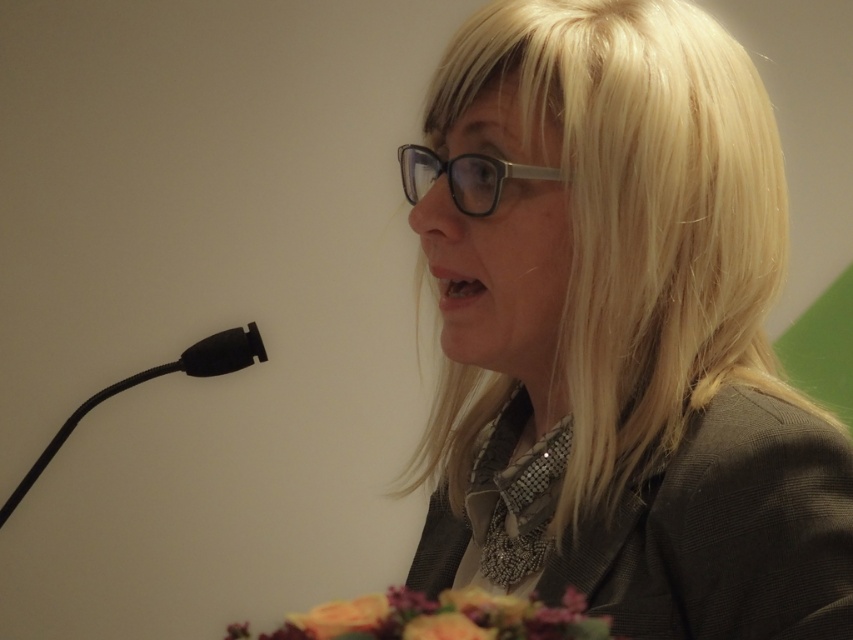
You are a photographer at the event and need to adjust the lighting so that the blonde silky hair at center and the black matte microphone at lower left are both well lit. Which object should you focus on first to ensure the taller one gets enough light?

The blonde silky hair at center is much taller than the black matte microphone at lower left, so you should focus on lighting the blonde silky hair at center first to ensure it is properly illuminated.

You are a photographer positioned at the camera. You need to capture a closeup shot of the floral bouquet at lower center. Considering the distance between you and the bouquet, can you move closer to take the photo without stepping over the 19.05 inches limit?

The distance between the floral bouquet at lower center and the camera is 19.05 inches. To take a closer shot without exceeding the limit, you can move closer as long as you stay within the 19.05 inches distance.

You are organizing a photo shoot and need to ensure that all elements are properly framed. Given the scene with the blonde silky hair at center and the black matte microphone at lower left, which object occupies more horizontal space in the image?

The blonde silky hair at center occupies more horizontal space in the image because its width is larger than that of the black matte microphone at lower left.